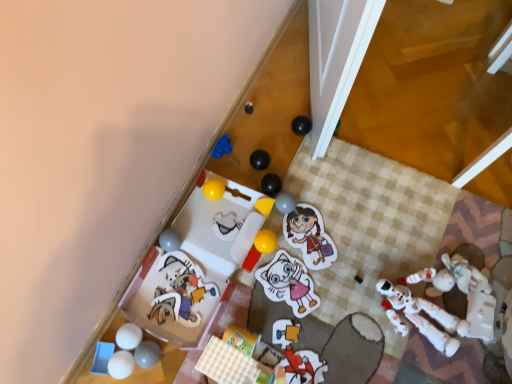
Identify the location of empty space that is in between cartoon cat plush at lower left, positioned as the 5th toy in left-to-right order, and white plastic toy at lower right, marked as the first toy in a right-to-left arrangement. (301, 299).